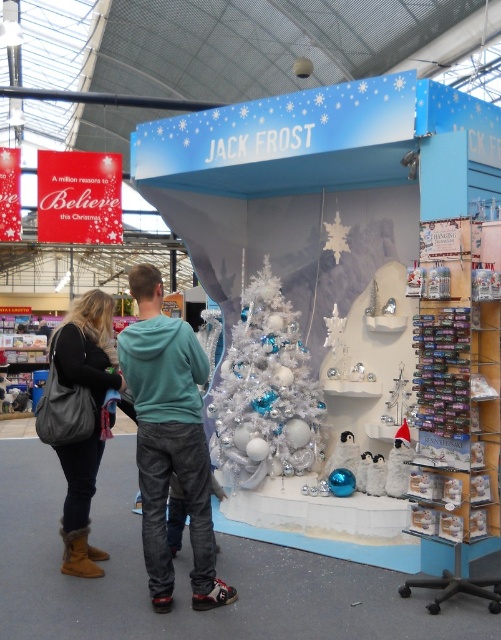
Question: Estimate the real-world distances between objects in this image. Which object is farther from the leather jacket at center?

Choices:
 (A) leather boots at lower left
 (B) white glossy christmas tree at center

Answer: (B)

Question: Does leather jacket at center have a greater width compared to white glossy christmas tree at center?

Choices:
 (A) yes
 (B) no

Answer: (A)

Question: Is leather jacket at center to the left of white glossy christmas tree at center from the viewer's perspective?

Choices:
 (A) no
 (B) yes

Answer: (B)

Question: Which object is the closest to the white glossy christmas tree at center?

Choices:
 (A) leather jacket at center
 (B) leather boots at lower left

Answer: (A)

Question: Can you confirm if leather jacket at center is bigger than leather boots at lower left?

Choices:
 (A) no
 (B) yes

Answer: (B)

Question: Which object is the closest to the leather jacket at center?

Choices:
 (A) leather boots at lower left
 (B) white glossy christmas tree at center

Answer: (A)